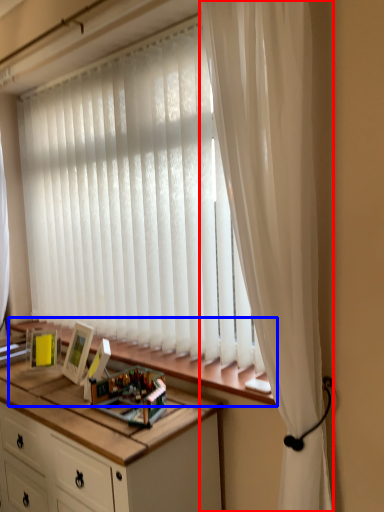
Question: Which point is closer to the camera, curtain (highlighted by a red box) or window sill (highlighted by a blue box)?

Choices:
 (A) curtain
 (B) window sill

Answer: (A)